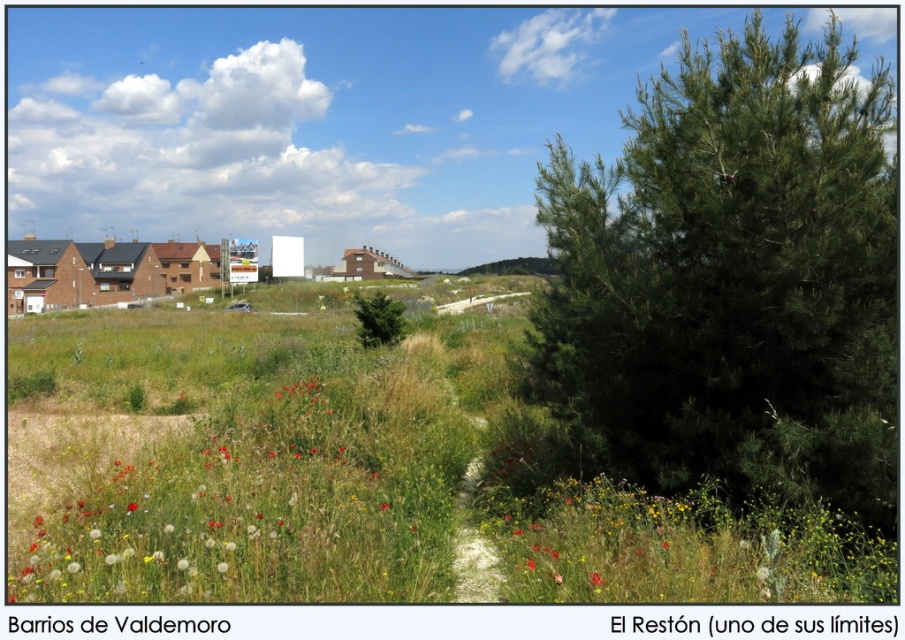
Who is taller, green needle-like at right or red matte flower at center?

Standing taller between the two is green needle-like at right.

Can you confirm if green needle-like at right is smaller than red matte flower at center?

Incorrect, green needle-like at right is not smaller in size than red matte flower at center.

Identify the location of green needle-like at right. The width and height of the screenshot is (905, 640). (734, 276).

Is green needle-like at right shorter than green matte tree at center?

No, green needle-like at right is not shorter than green matte tree at center.

Can you confirm if green needle-like at right is positioned to the left of green matte tree at center?

No, green needle-like at right is not to the left of green matte tree at center.

What do you see at coordinates (734, 276) in the screenshot? The image size is (905, 640). I see `green needle-like at right` at bounding box center [734, 276].

Where is `green needle-like at right`? green needle-like at right is located at coordinates (734, 276).

In the scene shown: Is green matte tree at center taller than red matte flower at center?

Yes.

This screenshot has height=640, width=905. What do you see at coordinates (378, 320) in the screenshot?
I see `green matte tree at center` at bounding box center [378, 320].

Who is more distant from viewer, (380, 339) or (596, 579)?

Positioned behind is point (380, 339).

Image resolution: width=905 pixels, height=640 pixels. In order to click on green matte tree at center in this screenshot , I will do `click(378, 320)`.